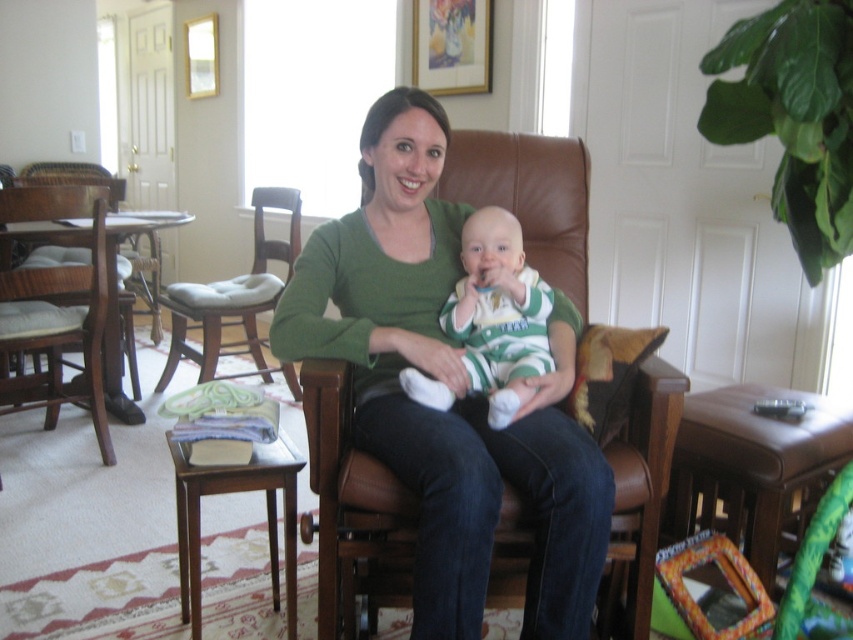
Question: Which object appears farthest from the camera in this image?

Choices:
 (A) brown wood chair at left
 (B) green matte shirt at center
 (C) wooden cushioned chair at center

Answer: (C)

Question: Which of the following is the closest to the observer?

Choices:
 (A) brown wood chair at left
 (B) wooden cushioned chair at center

Answer: (A)

Question: Which point is closer to the camera?

Choices:
 (A) (498, 369)
 (B) (227, 307)
 (C) (532, 452)
 (D) (114, 388)

Answer: (C)

Question: Is green matte shirt at center positioned in front of striped cotton onesie at center?

Choices:
 (A) yes
 (B) no

Answer: (A)

Question: Does striped cotton onesie at center appear under brown wood chair at left?

Choices:
 (A) yes
 (B) no

Answer: (A)

Question: Can you confirm if striped cotton onesie at center is positioned below brown wood chair at left?

Choices:
 (A) yes
 (B) no

Answer: (A)